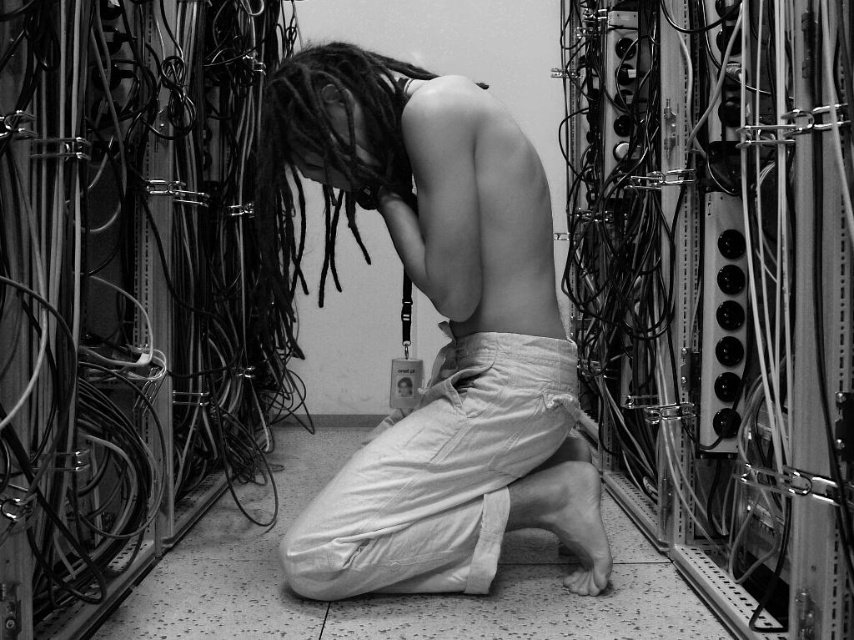
Question: Is matte white pants at center positioned at the back of light beige cotton pants at center?

Choices:
 (A) yes
 (B) no

Answer: (B)

Question: Is light beige cotton pants at center further to camera compared to dark dreadlocks at center?

Choices:
 (A) yes
 (B) no

Answer: (A)

Question: Among these objects, which one is farthest from the camera?

Choices:
 (A) metallic cables at left
 (B) matte white pants at center
 (C) light beige cotton pants at center

Answer: (C)

Question: Can you confirm if matte white pants at center is bigger than light beige cotton pants at center?

Choices:
 (A) yes
 (B) no

Answer: (A)

Question: Which point is farther from the camera taking this photo?

Choices:
 (A) (278, 80)
 (B) (325, 504)

Answer: (B)

Question: Considering the real-world distances, which object is closest to the light beige cotton pants at center?

Choices:
 (A) metallic cables at left
 (B) matte white pants at center

Answer: (B)